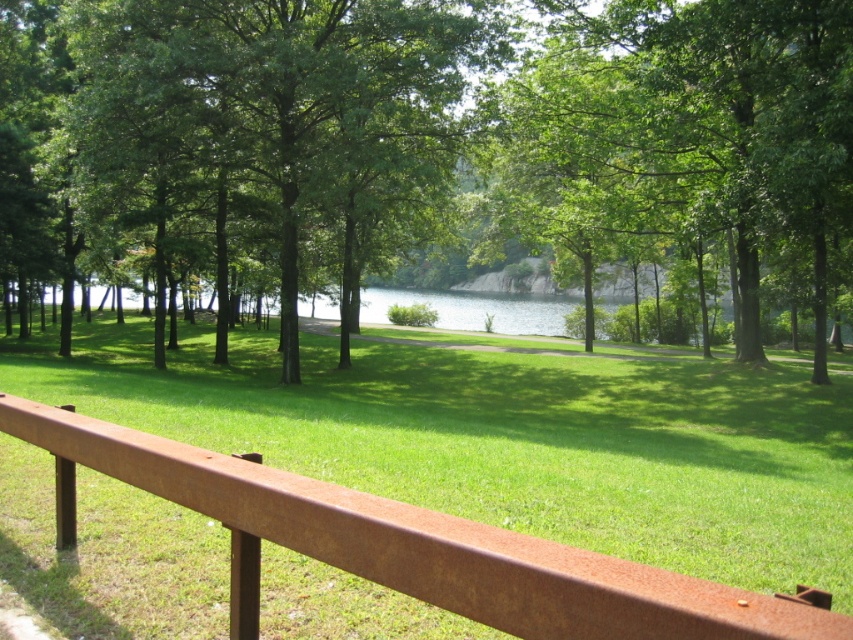
Question: Can you confirm if green leafy tree at center is smaller than rusty metal rail at center?

Choices:
 (A) yes
 (B) no

Answer: (B)

Question: Does green leafy tree at center appear on the right side of rusty metal rail at center?

Choices:
 (A) no
 (B) yes

Answer: (A)

Question: Which point is farther to the camera?

Choices:
 (A) green leafy tree at center
 (B) rusty metal rail at center

Answer: (A)

Question: From the image, what is the correct spatial relationship of green leafy tree at center in relation to rusty metal rail at center?

Choices:
 (A) below
 (B) above

Answer: (B)

Question: Which point is farther to the camera?

Choices:
 (A) (184, 44)
 (B) (531, 616)

Answer: (A)